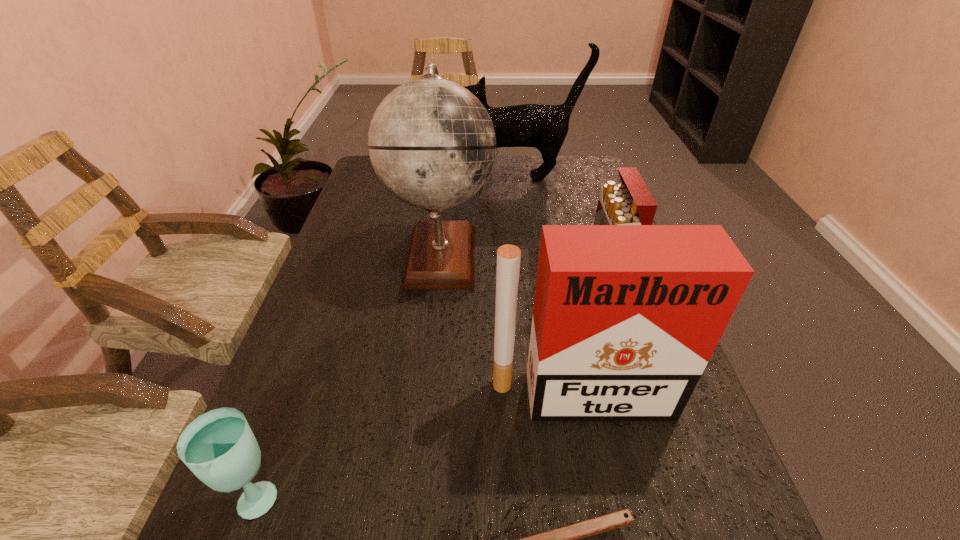
Identify the location of globe. Image resolution: width=960 pixels, height=540 pixels. (432, 144).

Image resolution: width=960 pixels, height=540 pixels. I want to click on the farthest object, so pyautogui.click(x=544, y=127).

This screenshot has width=960, height=540. Identify the location of the fourth farthest object. (626, 317).

Image resolution: width=960 pixels, height=540 pixels. Identify the location of the fourth shortest object. (626, 317).

The height and width of the screenshot is (540, 960). Identify the location of the fourth tallest object. (630, 203).

Locate an element on the screen. Image resolution: width=960 pixels, height=540 pixels. the shorter cigarette case is located at coordinates (630, 203).

Find the location of a particular element. The height and width of the screenshot is (540, 960). the leftmost object is located at coordinates (219, 447).

The width and height of the screenshot is (960, 540). What are the coordinates of `the second shortest object` in the screenshot? It's located at (219, 447).

You are a GUI agent. You are given a task and a screenshot of the screen. Output one action in this format:
    pyautogui.click(x=<x>, y=<y>)
    Task: Click on the vacant space situated at the equator of the globe
    The image size is (960, 540).
    Given the screenshot: What is the action you would take?
    pyautogui.click(x=617, y=254)

Find the location of a particular element. free spot located on the face of the farthest object is located at coordinates (411, 177).